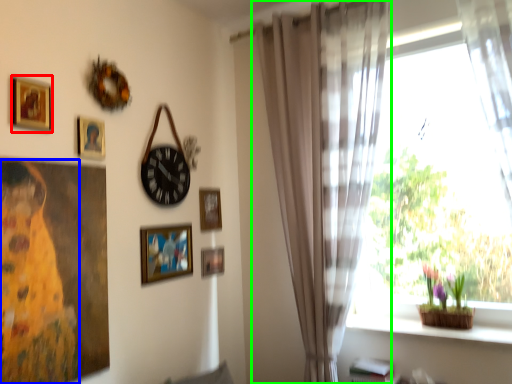
Question: Estimate the real-world distances between objects in this image. Which object is farther from picture frame (highlighted by a red box), woman (highlighted by a blue box) or curtain (highlighted by a green box)?

Choices:
 (A) woman
 (B) curtain

Answer: (B)